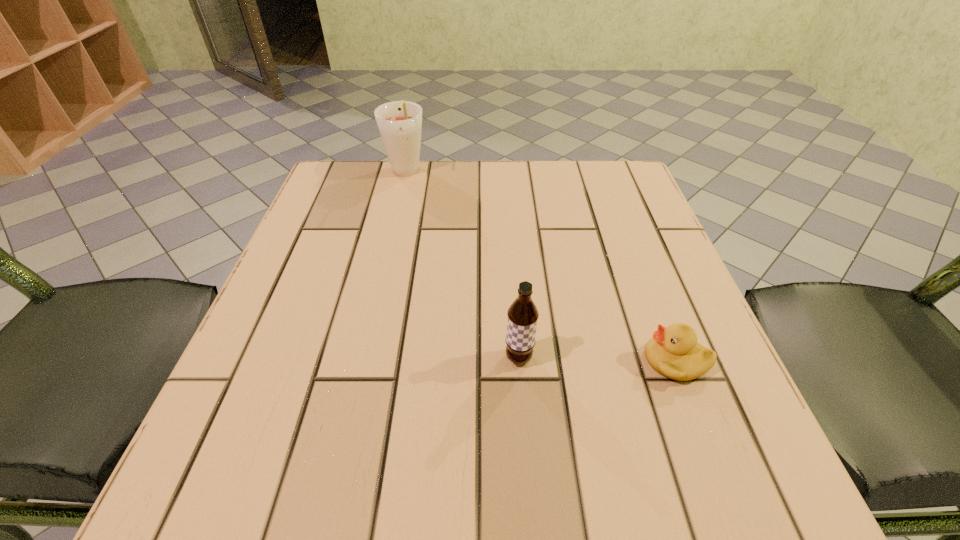
The image size is (960, 540). I want to click on vacant area situated on the front-facing side of the shortest object, so click(x=574, y=361).

Find the location of a particular element. object that is at the far edge is located at coordinates (399, 122).

The image size is (960, 540). What are the coordinates of `object at the left edge` in the screenshot? It's located at (399, 122).

Locate an element on the screen. object that is positioned at the right edge is located at coordinates (674, 352).

Where is `object at the far left corner`? Image resolution: width=960 pixels, height=540 pixels. object at the far left corner is located at coordinates (399, 122).

Locate an element on the screen. The image size is (960, 540). vacant position at the far edge of the desktop is located at coordinates (451, 171).

Image resolution: width=960 pixels, height=540 pixels. Find the location of `free space at the near edge`. free space at the near edge is located at coordinates (602, 501).

Where is `vacant space at the left edge`? vacant space at the left edge is located at coordinates (324, 425).

Where is `vacant space at the right edge of the desktop`? Image resolution: width=960 pixels, height=540 pixels. vacant space at the right edge of the desktop is located at coordinates (652, 226).

The image size is (960, 540). In the image, there is a desktop. In order to click on vacant space at the far left corner in this screenshot , I will do `click(348, 212)`.